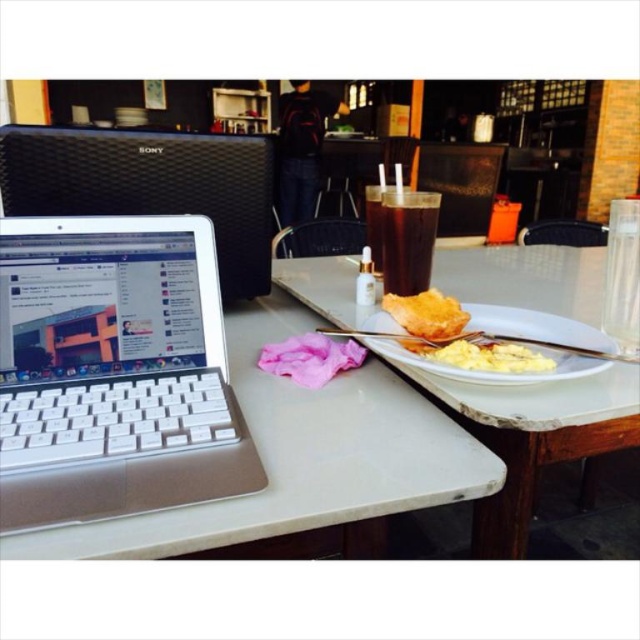
You are a food critic who needs to take a photo of the golden crispy bread at center. The white fluffy scrambled eggs at right are blocking the view. Can you move the scrambled eggs to the left to make space?

The white fluffy scrambled eggs at right might be wider than golden crispy bread at center, so moving them to the left may not provide enough space since they could be wider and thus require more room.

You are a food delivery person who needs to place a hot beverage on the table without touching the white fluffy scrambled eggs at right. The beverage must be placed within 60 centimeters from the camera. Can you place it there?

The distance of white fluffy scrambled eggs at right from camera is 57.92 centimeters. Since the beverage needs to be placed within 60 centimeters from the camera, the delivery person can place the beverage near the white fluffy scrambled eggs at right as it is within the required distance.

You are a customer at this cafe and want to reach for the golden crispy bread at center without touching the white fluffy scrambled eggs at right. Can you do that easily?

The white fluffy scrambled eggs at right is located below the golden crispy bread at center, so you can easily reach the golden crispy bread at center without disturbing the scrambled eggs.